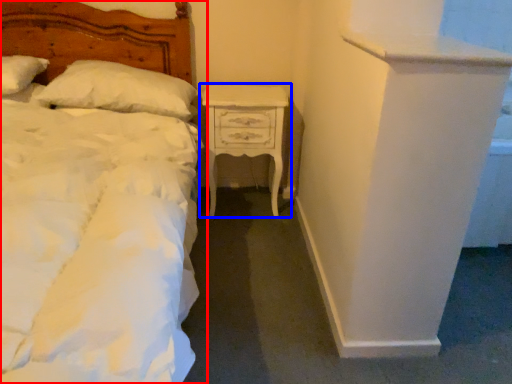
Question: Which object is closer to the camera taking this photo, bed (highlighted by a red box) or nightstand (highlighted by a blue box)?

Choices:
 (A) bed
 (B) nightstand

Answer: (A)